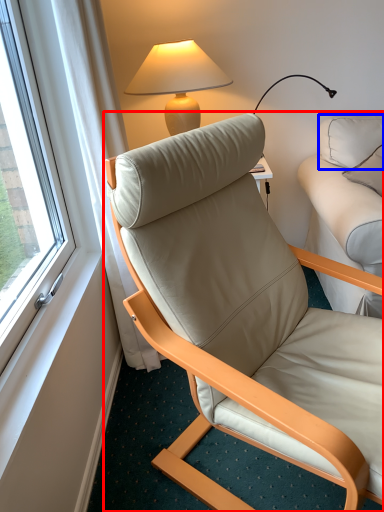
Question: Which object appears closest to the camera in this image, chair (highlighted by a red box) or pillow (highlighted by a blue box)?

Choices:
 (A) chair
 (B) pillow

Answer: (A)